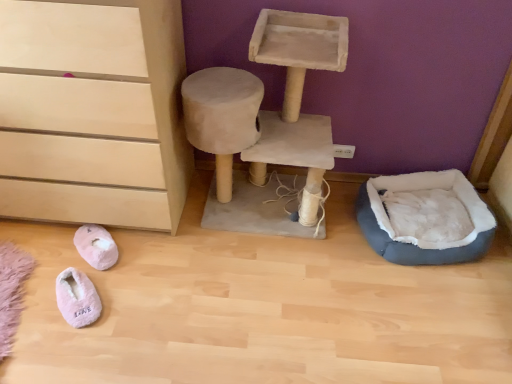
Question: Would you say matte wood chest of drawers at lower left is inside or outside pink fluffy slippers at lower left, which is the first footwear from front to back?

Choices:
 (A) inside
 (B) outside

Answer: (B)

Question: From a real-world perspective, is matte wood chest of drawers at lower left positioned above or below pink fluffy slippers at lower left, arranged as the 2th footwear when viewed from the back?

Choices:
 (A) below
 (B) above

Answer: (B)

Question: Considering the real-world distances, which object is farthest from the matte wood chest of drawers at lower left?

Choices:
 (A) gray plush pet bed at lower right
 (B) pink fuzzy slippers at lower left, the second footwear in the front-to-back sequence
 (C) pink fluffy slippers at lower left, arranged as the 2th footwear when viewed from the back

Answer: (A)

Question: Considering the real-world distances, which object is closest to the gray plush pet bed at lower right?

Choices:
 (A) matte wood chest of drawers at lower left
 (B) pink fluffy slippers at lower left, which is the first footwear from front to back
 (C) pink fuzzy slippers at lower left, the second footwear in the front-to-back sequence

Answer: (A)